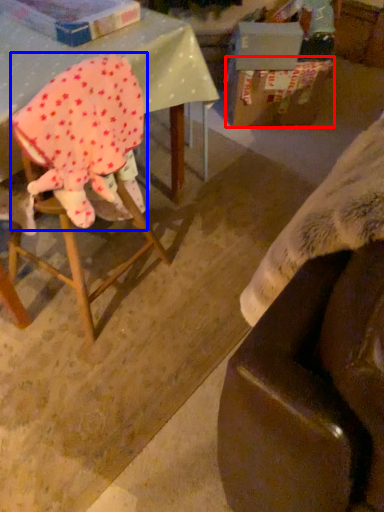
Question: Which object is closer to the camera taking this photo, cardboard box (highlighted by a red box) or woman (highlighted by a blue box)?

Choices:
 (A) cardboard box
 (B) woman

Answer: (B)